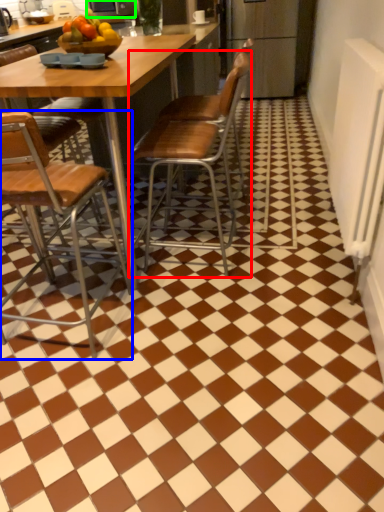
Question: Estimate the real-world distances between objects in this image. Which object is farther from chair (highlighted by a red box), chair (highlighted by a blue box) or appliance (highlighted by a green box)?

Choices:
 (A) chair
 (B) appliance

Answer: (B)